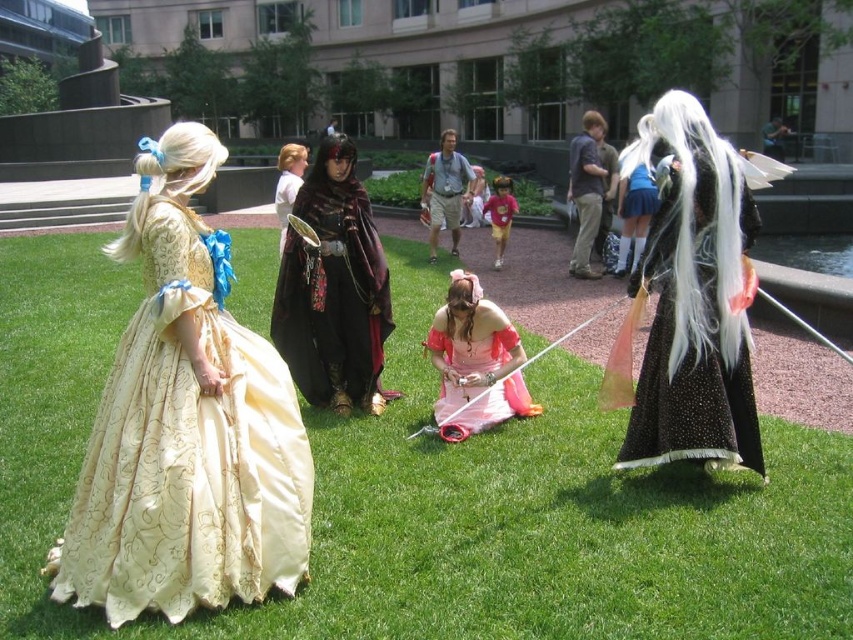
Looking at this image, you are a photographer aiming to capture a group photo of the velvet maroon cape at center and the silky white wig at upper right. Which object should you focus on first if you want to ensure both are in sharp focus, considering their sizes?

The velvet maroon cape at center has a lesser width compared to the silky white wig at upper right, so you should focus on the silky white wig at upper right first because it is larger and requires more precise focus to ensure sharpness.

You are a photographer positioned at the front of the scene. You want to take a photo that includes both the velvet maroon cape at center and the silky white wig at upper right. Which object will appear closer to the camera in the photo?

The velvet maroon cape at center will appear closer to the camera because it is further to the viewer than the silky white wig at upper right.